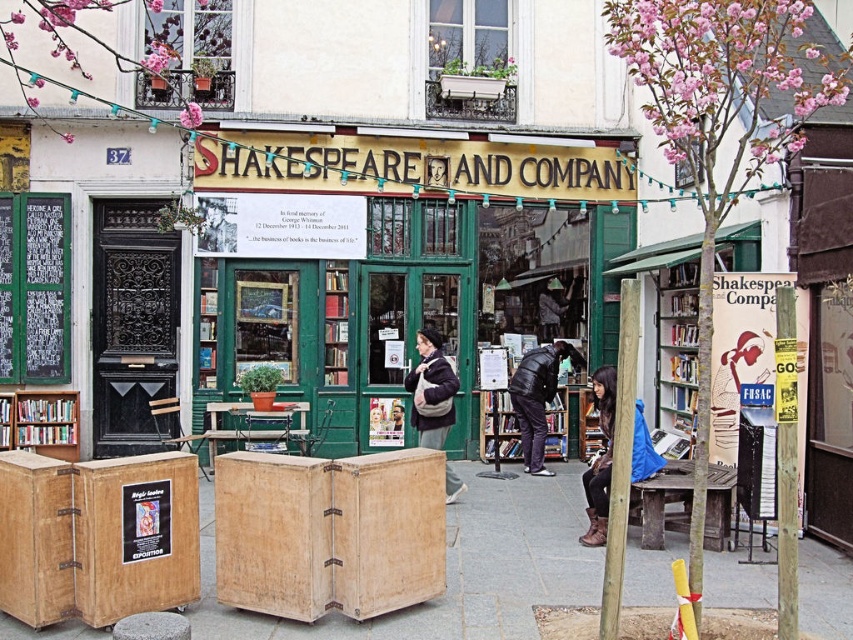
You are standing in front of the entrance of Shakespeare and Company bookstore. You notice two points marked on the building facade. The first point is at coordinate point [601,456] and the second is at point [65,400]. Which of these points is physically closer to your current position?

Point [601,456] is closer to the viewer than point [65,400], so the first point is closer to your current position.

You are standing in front of the bookstore and want to move closer to the wooden crates at center. Which direction should you move relative to the green wooden bookstore at center?

Since the green wooden bookstore at center is further to the viewer than wooden crates at center, you should move forward towards the green wooden bookstore at center to get closer to the wooden crates at center.

You are standing at the entrance of the bookstore and want to find the exact location of the green wooden bookstore at center. According to the coordinates provided, where is it located?

The green wooden bookstore at center is located at coordinates point (x=402, y=266).